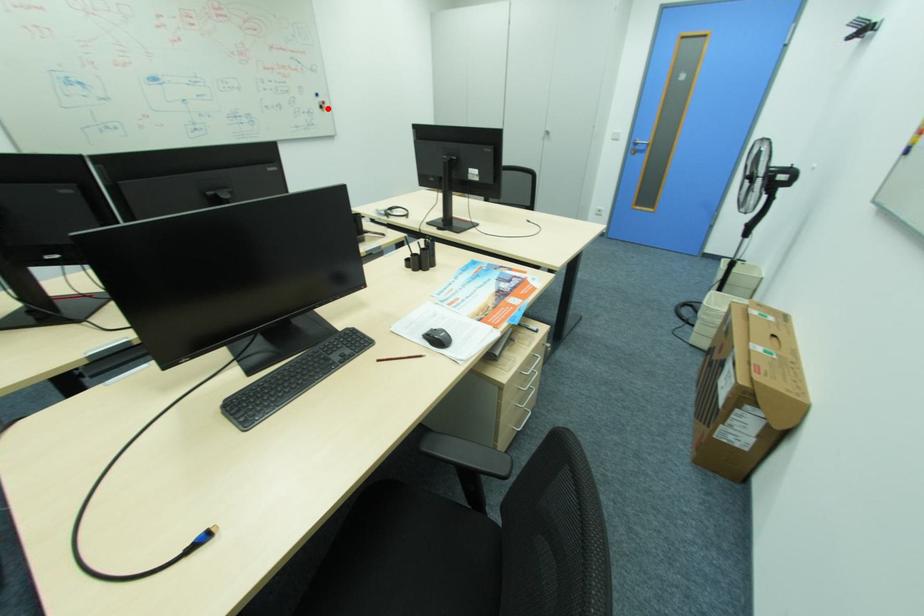
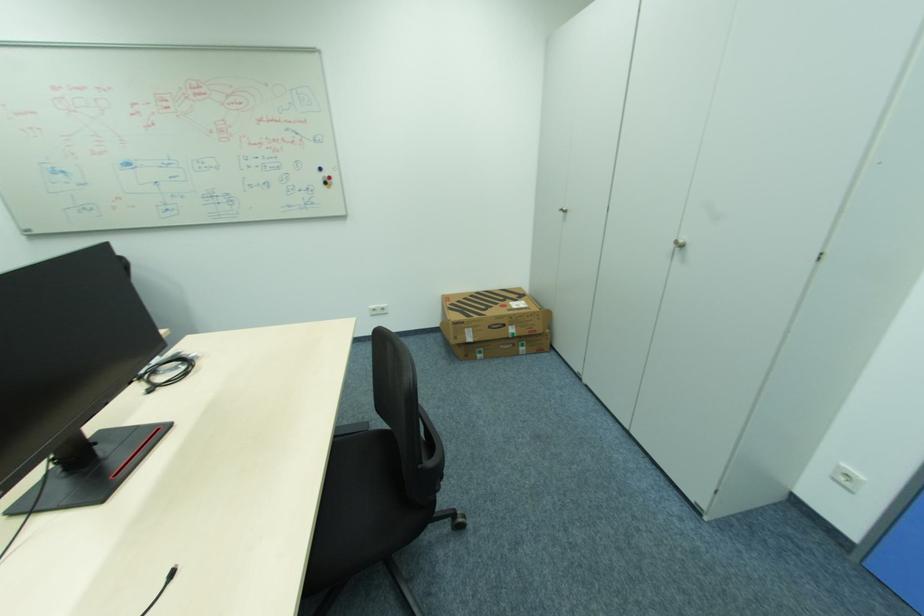
In the second image, find the point that corresponds to the highlighted location in the first image.

(331, 184)